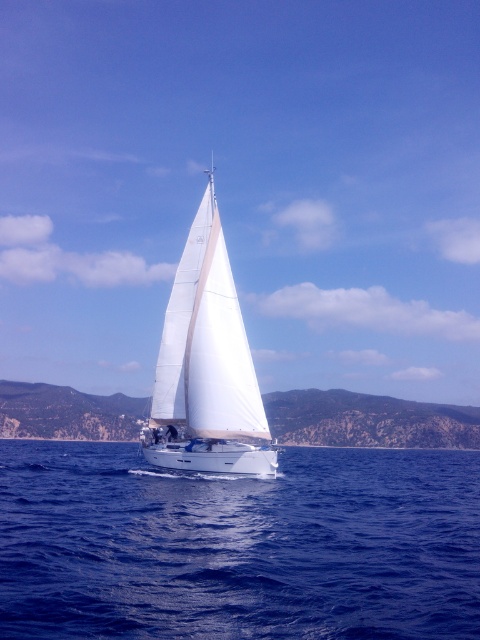
Who is positioned more to the right, blue liquid water at center or white matte sailboat at center?

Positioned to the right is blue liquid water at center.

Can you confirm if blue liquid water at center is positioned below white matte sailboat at center?

Correct, blue liquid water at center is located below white matte sailboat at center.

Who is more distant from viewer, (20,497) or (251,365)?

The point (251,365) is more distant.

The image size is (480, 640). What are the coordinates of `blue liquid water at center` in the screenshot? It's located at click(x=238, y=545).